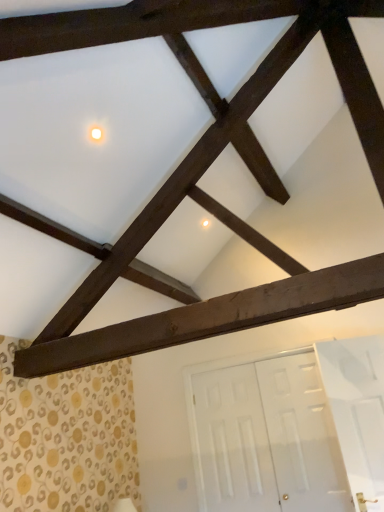
Question: From a real-world perspective, is dark brown wood at center beneath white glossy light at upper center?

Choices:
 (A) yes
 (B) no

Answer: (A)

Question: From a real-world perspective, is dark brown wood at center over white glossy light at upper center?

Choices:
 (A) yes
 (B) no

Answer: (B)

Question: Are dark brown wood at center and white glossy light at upper center far apart?

Choices:
 (A) yes
 (B) no

Answer: (A)

Question: Does dark brown wood at center come in front of white glossy light at upper center?

Choices:
 (A) yes
 (B) no

Answer: (A)

Question: Can you confirm if dark brown wood at center is taller than white glossy light at upper center?

Choices:
 (A) no
 (B) yes

Answer: (B)

Question: Can you confirm if dark brown wood at center is smaller than white glossy light at upper center?

Choices:
 (A) no
 (B) yes

Answer: (A)

Question: Is white glossy door at lower right positioned before dark brown wood at center?

Choices:
 (A) no
 (B) yes

Answer: (A)

Question: Is white glossy door at lower right not within dark brown wood at center?

Choices:
 (A) yes
 (B) no

Answer: (A)

Question: From a real-world perspective, does white glossy door at lower right sit lower than dark brown wood at center?

Choices:
 (A) yes
 (B) no

Answer: (A)

Question: Is white glossy door at lower right facing towards dark brown wood at center?

Choices:
 (A) yes
 (B) no

Answer: (A)

Question: Does white glossy door at lower right touch dark brown wood at center?

Choices:
 (A) yes
 (B) no

Answer: (B)

Question: Does white glossy door at lower right have a greater height compared to dark brown wood at center?

Choices:
 (A) no
 (B) yes

Answer: (B)

Question: Would you say white glossy door at lower right is outside white glossy light at upper center?

Choices:
 (A) yes
 (B) no

Answer: (A)